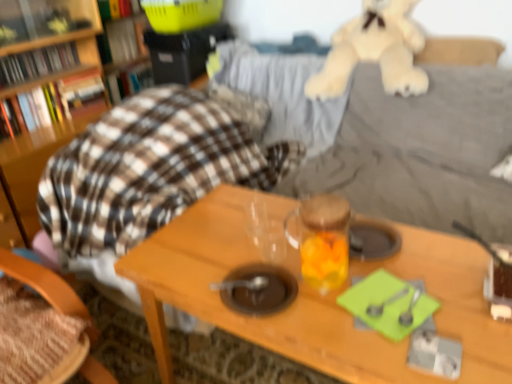
What do you see at coordinates (374, 51) in the screenshot? I see `soft beige plush at upper right` at bounding box center [374, 51].

Image resolution: width=512 pixels, height=384 pixels. Find the location of `soft beige plush at upper right`. soft beige plush at upper right is located at coordinates (374, 51).

The image size is (512, 384). What do you see at coordinates (251, 315) in the screenshot?
I see `wooden table at center` at bounding box center [251, 315].

Locate an element on the screen. This screenshot has width=512, height=384. hardcover book at upper left, the fourth book in the bottom-to-top sequence is located at coordinates [x=129, y=80].

Does point (9, 126) appear closer or farther from the camera than point (112, 95)?

Clearly, point (9, 126) is closer to the camera than point (112, 95).

Would you say hardcover book at left, which appears as the 6th book when viewed from the top, contains hardcover book at upper left, positioned as the third book in top-to-bottom order?

Actually, hardcover book at upper left, positioned as the third book in top-to-bottom order, is outside hardcover book at left, which appears as the 6th book when viewed from the top.

How different are the orientations of hardcover book at left, which appears as the 6th book when viewed from the top, and hardcover book at upper left, positioned as the third book in top-to-bottom order, in degrees?

The facing directions of hardcover book at left, which appears as the 6th book when viewed from the top, and hardcover book at upper left, positioned as the third book in top-to-bottom order, are 2.47 degrees apart.

In terms of width, does hardcover book at left, which appears as the 6th book when viewed from the top, look wider or thinner when compared to hardcover book at upper left, positioned as the third book in top-to-bottom order?

Clearly, hardcover book at left, which appears as the 6th book when viewed from the top, has more width compared to hardcover book at upper left, positioned as the third book in top-to-bottom order.

Is point (346, 244) farther from camera compared to point (13, 75)?

No, (346, 244) is closer to viewer.

From a real-world perspective, is transparent glass jar at center on top of matte black bookshelf at upper left, the 4th book viewed from the top?

Actually, transparent glass jar at center is physically below matte black bookshelf at upper left, the 4th book viewed from the top, in the real world.

Considering the relative sizes of transparent glass jar at center and matte black bookshelf at upper left, which appears as the 3th book when ordered from the bottom, in the image provided, is transparent glass jar at center wider than matte black bookshelf at upper left, which appears as the 3th book when ordered from the bottom,?

Indeed, transparent glass jar at center has a greater width compared to matte black bookshelf at upper left, which appears as the 3th book when ordered from the bottom.

From the image's perspective, which object appears higher, transparent glass jar at center or matte black bookshelf at upper left, the 4th book viewed from the top?

matte black bookshelf at upper left, the 4th book viewed from the top, from the image's perspective.

Where is `the 2nd book positioned below the green plastic toy at upper left, which ranks as the 2th book in top-to-bottom order (from the image's perspective)`? Image resolution: width=512 pixels, height=384 pixels. the 2nd book positioned below the green plastic toy at upper left, which ranks as the 2th book in top-to-bottom order (from the image's perspective) is located at coordinates (37, 63).

Considering the sizes of objects green plastic toy at upper left, the fifth book from the bottom, and matte black bookshelf at upper left, which appears as the 3th book when ordered from the bottom, in the image provided, who is taller, green plastic toy at upper left, the fifth book from the bottom, or matte black bookshelf at upper left, which appears as the 3th book when ordered from the bottom,?

Standing taller between the two is green plastic toy at upper left, the fifth book from the bottom.

Between green plastic toy at upper left, the fifth book from the bottom, and matte black bookshelf at upper left, which appears as the 3th book when ordered from the bottom, which one appears on the left side from the viewer's perspective?

From the viewer's perspective, matte black bookshelf at upper left, which appears as the 3th book when ordered from the bottom, appears more on the left side.

Who is smaller, green plastic toy at upper left, the fifth book from the bottom, or matte black bookshelf at upper left, the 4th book viewed from the top?

matte black bookshelf at upper left, the 4th book viewed from the top, is smaller.

Does matte black bookshelf at upper left, which appears as the 3th book when ordered from the bottom, turn towards hardcover book at upper left, the first book from the top?

No, matte black bookshelf at upper left, which appears as the 3th book when ordered from the bottom, is not facing towards hardcover book at upper left, the first book from the top.

Is matte black bookshelf at upper left, the 4th book viewed from the top, not near hardcover book at upper left, the first book from the top?

They are positioned close to each other.

Consider the image. Considering the relative positions of matte black bookshelf at upper left, which appears as the 3th book when ordered from the bottom, and hardcover book at upper left, the first book from the top, in the image provided, is matte black bookshelf at upper left, which appears as the 3th book when ordered from the bottom, to the right of hardcover book at upper left, the first book from the top, from the viewer's perspective?

No.

From a real-world perspective, is matte black bookshelf at upper left, which appears as the 3th book when ordered from the bottom, over hardcover book at upper left, which is the sixth book from bottom to top?

No, from a real-world perspective, matte black bookshelf at upper left, which appears as the 3th book when ordered from the bottom, is not above hardcover book at upper left, which is the sixth book from bottom to top.

Can you confirm if transparent glass jar at center is bigger than hardcover book at upper left, the first book from the top?

No, transparent glass jar at center is not bigger than hardcover book at upper left, the first book from the top.

From a real-world perspective, who is located higher, transparent glass jar at center or hardcover book at upper left, the first book from the top?

From a 3D spatial view, hardcover book at upper left, the first book from the top, is above.

From their relative heights in the image, would you say transparent glass jar at center is taller or shorter than hardcover book at upper left, the first book from the top?

In the image, transparent glass jar at center appears to be taller than hardcover book at upper left, the first book from the top.

In the scene shown: Is wooden chair at left to the left or to the right of green plastic toy at upper left, which ranks as the 2th book in top-to-bottom order, in the image?

Based on their positions, wooden chair at left is located to the right of green plastic toy at upper left, which ranks as the 2th book in top-to-bottom order.

Looking at their sizes, would you say wooden chair at left is wider or thinner than green plastic toy at upper left, which ranks as the 2th book in top-to-bottom order?

Considering their sizes, wooden chair at left looks broader than green plastic toy at upper left, which ranks as the 2th book in top-to-bottom order.

Can you tell me how much wooden chair at left and green plastic toy at upper left, the fifth book from the bottom, differ in facing direction?

The angle between the facing direction of wooden chair at left and the facing direction of green plastic toy at upper left, the fifth book from the bottom, is 1.82 degrees.

From the image's perspective, which is above, wooden table at center or hardcover book at upper left, the first book from the top?

hardcover book at upper left, the first book from the top, is shown above in the image.

Does wooden table at center have a lesser height compared to hardcover book at upper left, the first book from the top?

Incorrect, the height of wooden table at center does not fall short of that of hardcover book at upper left, the first book from the top.

Could you tell me if wooden table at center is turned towards hardcover book at upper left, which is the sixth book from bottom to top?

No.

From a real-world perspective, is wooden table at center positioned above or below hardcover book at upper left, the first book from the top?

wooden table at center is situated lower than hardcover book at upper left, the first book from the top, in the real world.

Starting from the hardcover book at left, which appears as the 6th book when viewed from the top, which book is the 5th one behind? Please provide its 2D coordinates.

[(129, 80)]

Find the location of a particular element. The height and width of the screenshot is (384, 512). book that is the 1st object above the transparent glass jar at center (from a real-world perspective) is located at coordinates (37, 63).

Estimate the real-world distances between objects in this image. Which object is further from soft beige plush at upper right, matte black bookshelf at upper left, which appears as the 3th book when ordered from the bottom, or wooden chair at left?

wooden chair at left is positioned further to the anchor soft beige plush at upper right.

From the image, which object appears to be nearer to hardcover book at upper left, positioned as the third book in top-to-bottom order, hardcover book at left, which is the 1th book in bottom-to-top order, or hardcover book at upper left, the first book from the top?

Among the two, hardcover book at upper left, the first book from the top, is located nearer to hardcover book at upper left, positioned as the third book in top-to-bottom order.

When comparing their distances from hardcover book at upper left, which is the sixth book from bottom to top, does hardcover book at upper left, the fourth book in the bottom-to-top sequence, or matte black bookshelf at upper left, which appears as the 3th book when ordered from the bottom, seem further?

matte black bookshelf at upper left, which appears as the 3th book when ordered from the bottom, lies further to hardcover book at upper left, which is the sixth book from bottom to top, than the other object.

Considering their positions, is soft beige plush at upper right positioned closer to wooden table at center than hardcover book at upper left, the 5th book when ordered from top to bottom?

soft beige plush at upper right is closer to wooden table at center.

Looking at the image, which one is located closer to green plastic toy at upper left, the fifth book from the bottom, hardcover book at upper left, positioned as the third book in top-to-bottom order, or hardcover book at left, which appears as the 6th book when viewed from the top?

hardcover book at upper left, positioned as the third book in top-to-bottom order, lies closer to green plastic toy at upper left, the fifth book from the bottom, than the other object.

Considering their positions, is green plastic toy at upper left, the fifth book from the bottom, positioned closer to hardcover book at upper left, the 5th book when ordered from top to bottom, than matte black bookshelf at upper left, the 4th book viewed from the top?

Based on the image, matte black bookshelf at upper left, the 4th book viewed from the top, appears to be nearer to hardcover book at upper left, the 5th book when ordered from top to bottom.

Based on their spatial positions, is hardcover book at left, which is the 1th book in bottom-to-top order, or green plastic toy at upper left, the fifth book from the bottom, further from soft beige plush at upper right?

hardcover book at left, which is the 1th book in bottom-to-top order, is further to soft beige plush at upper right.

Which object lies further to the anchor point hardcover book at left, which appears as the 6th book when viewed from the top, transparent glass jar at center or matte black bookshelf at upper left, which appears as the 3th book when ordered from the bottom?

The object further to hardcover book at left, which appears as the 6th book when viewed from the top, is transparent glass jar at center.

I want to click on chair positioned between wooden table at center and hardcover book at upper left, which is the sixth book from bottom to top, from near to far, so click(x=44, y=283).

Locate an element on the screen. The height and width of the screenshot is (384, 512). teddy bear located between wooden table at center and hardcover book at upper left, the fourth book in the bottom-to-top sequence, in the depth direction is located at coordinates (374, 51).

Locate an element on the screen. book positioned between wooden chair at left and matte black bookshelf at upper left, which appears as the 3th book when ordered from the bottom, from near to far is located at coordinates (48, 103).

Where is `book between hardcover book at upper left, the first book from the top, and hardcover book at upper left, positioned as the third book in top-to-bottom order, in the up-down direction`? book between hardcover book at upper left, the first book from the top, and hardcover book at upper left, positioned as the third book in top-to-bottom order, in the up-down direction is located at coordinates (122, 41).